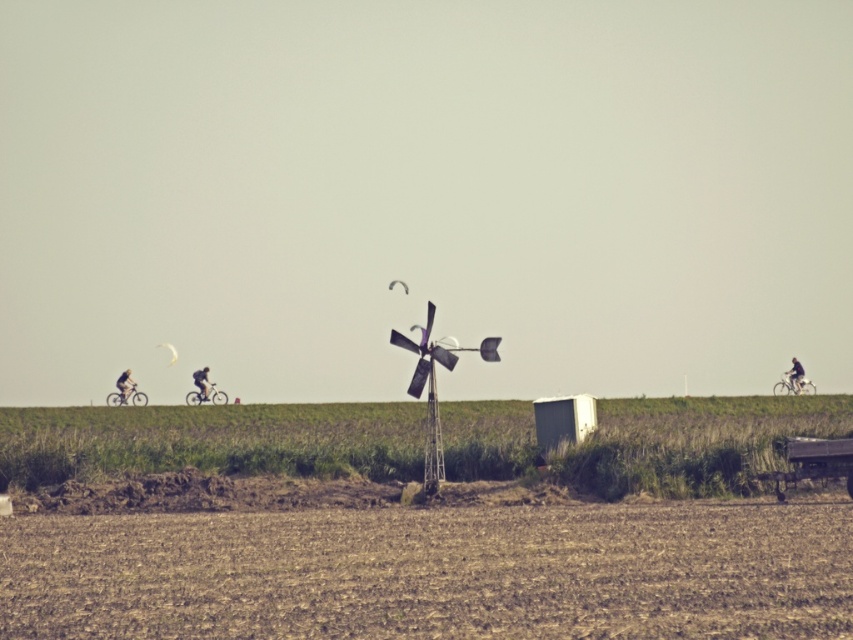
Is brown soil at lower center below transparent yellow parachute at upper center?

Indeed, brown soil at lower center is positioned under transparent yellow parachute at upper center.

Which of these two, brown soil at lower center or transparent yellow parachute at upper center, stands taller?

brown soil at lower center

What are the coordinates of `brown soil at lower center` in the screenshot? It's located at (434, 572).

Find the location of `brown soil at lower center`. brown soil at lower center is located at coordinates (434, 572).

Does silver metallic bicycle at right appear over dark gray bicycle at left?

Actually, silver metallic bicycle at right is below dark gray bicycle at left.

Is silver metallic bicycle at right thinner than dark gray bicycle at left?

Yes, silver metallic bicycle at right is thinner than dark gray bicycle at left.

What do you see at coordinates (793, 385) in the screenshot? Image resolution: width=853 pixels, height=640 pixels. I see `silver metallic bicycle at right` at bounding box center [793, 385].

At what (x,y) coordinates should I click in order to perform the action: click on silver metallic bicycle at right. Please return your answer as a coordinate pair (x, y). Image resolution: width=853 pixels, height=640 pixels. Looking at the image, I should click on (793, 385).

The image size is (853, 640). What do you see at coordinates (795, 376) in the screenshot? I see `dark blue fabric cyclist at upper center` at bounding box center [795, 376].

Image resolution: width=853 pixels, height=640 pixels. Describe the element at coordinates (795, 376) in the screenshot. I see `dark blue fabric cyclist at upper center` at that location.

I want to click on dark blue fabric cyclist at upper center, so (x=795, y=376).